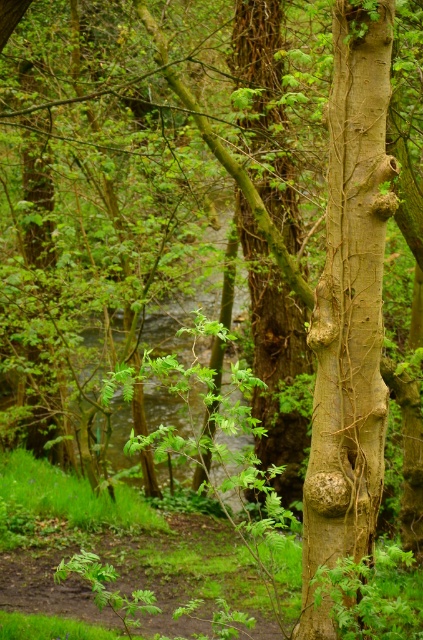
Based on the photo, which is above, smooth brown bark at right or green rough bark tree trunk at center?

green rough bark tree trunk at center is higher up.

Can you confirm if smooth brown bark at right is bigger than green rough bark tree trunk at center?

Incorrect, smooth brown bark at right is not larger than green rough bark tree trunk at center.

Where is `smooth brown bark at right`? smooth brown bark at right is located at coordinates (349, 308).